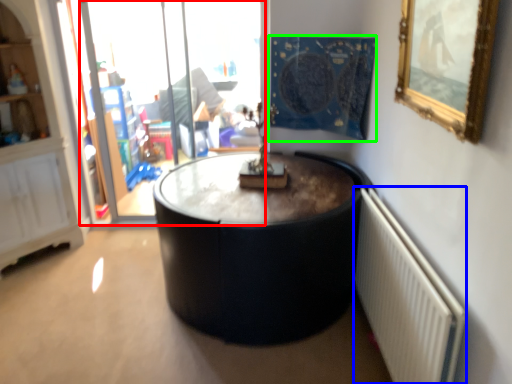
Question: Estimate the real-world distances between objects in this image. Which object is farther from glass door (highlighted by a red box), radiator (highlighted by a blue box) or tapestry (highlighted by a green box)?

Choices:
 (A) radiator
 (B) tapestry

Answer: (A)